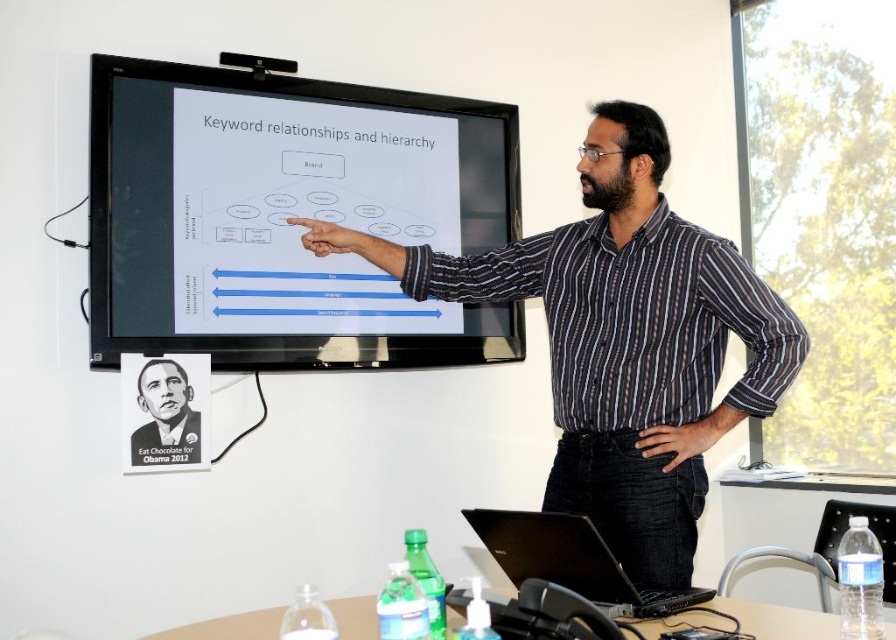
Can you confirm if black striped shirt at center is thinner than black matte laptop at center?

In fact, black striped shirt at center might be wider than black matte laptop at center.

Is point (647, 177) positioned behind point (610, 605)?

Yes, it is behind point (610, 605).

Find the location of a particular element. This screenshot has width=896, height=640. black striped shirt at center is located at coordinates (623, 340).

Between matte black screen at upper center and black striped shirt at center, which one appears on the left side from the viewer's perspective?

Positioned to the left is matte black screen at upper center.

You are a GUI agent. You are given a task and a screenshot of the screen. Output one action in this format:
    pyautogui.click(x=<x>, y=<y>)
    Task: Click on the matte black screen at upper center
    
    Given the screenshot: What is the action you would take?
    pyautogui.click(x=286, y=212)

Where is `matte black screen at upper center`? Image resolution: width=896 pixels, height=640 pixels. matte black screen at upper center is located at coordinates (286, 212).

Between black matte laptop at center and black paper poster at upper left, which one is positioned higher?

black paper poster at upper left is above.

Is black matte laptop at center thinner than black paper poster at upper left?

No, black matte laptop at center is not thinner than black paper poster at upper left.

What do you see at coordinates (571, 561) in the screenshot?
I see `black matte laptop at center` at bounding box center [571, 561].

Find the location of a particular element. The width and height of the screenshot is (896, 640). black matte laptop at center is located at coordinates (571, 561).